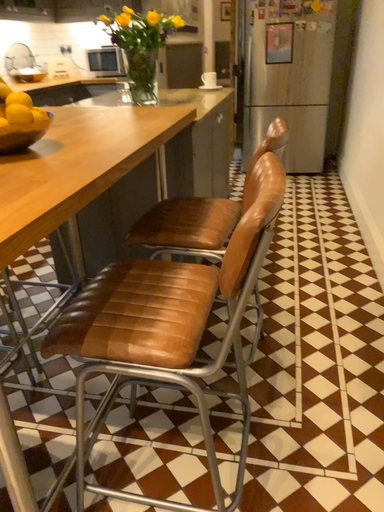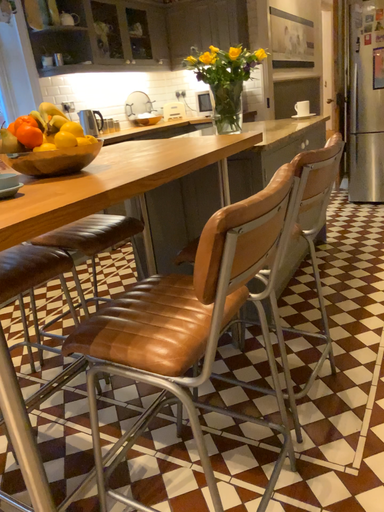
Question: Which way did the camera rotate in the video?

Choices:
 (A) rotated left
 (B) rotated right

Answer: (A)